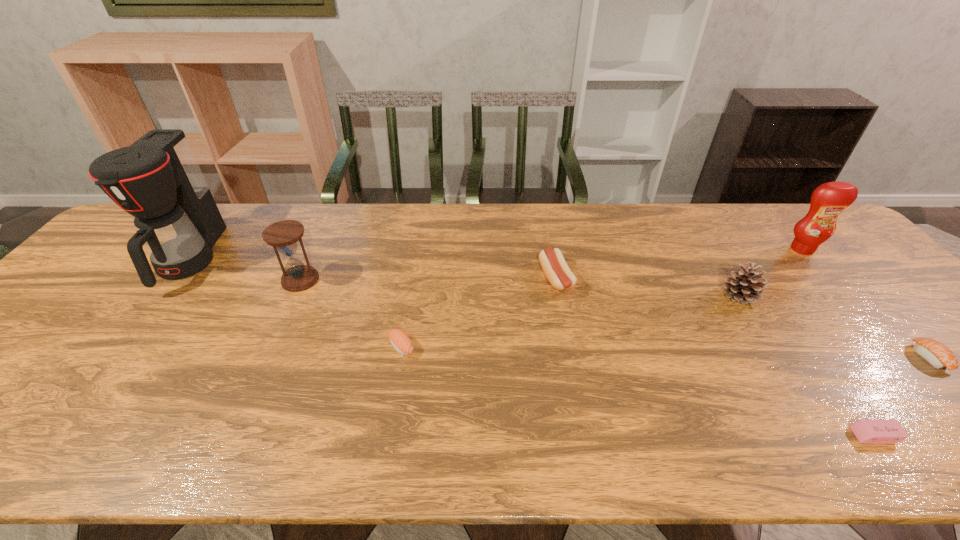
At what (x,y) coordinates should I click in order to perform the action: click on free spot located 0.120m on the front of the sixth object from right to left. Please return your answer as a coordinate pair (x, y). The image size is (960, 540). Looking at the image, I should click on (391, 405).

Where is `vacant space located on the left of the shorter sushi`? The width and height of the screenshot is (960, 540). vacant space located on the left of the shorter sushi is located at coordinates (825, 357).

Find the location of a particular element. This screenshot has width=960, height=540. vacant space positioned on the left of the eraser is located at coordinates (818, 435).

I want to click on coffee maker positioned at the far edge, so 157,179.

At what (x,y) coordinates should I click in order to perform the action: click on condiment that is at the far edge. Please return your answer as a coordinate pair (x, y). Looking at the image, I should click on (828, 200).

Locate an element on the screen. object at the near edge is located at coordinates (866, 431).

Locate an element on the screen. Image resolution: width=960 pixels, height=540 pixels. condiment at the right edge is located at coordinates (828, 200).

Identify the location of sushi located in the right edge section of the desktop. (937, 354).

Identify the location of object that is at the far right corner. (828, 200).

I want to click on vacant space at the far edge of the desktop, so click(428, 212).